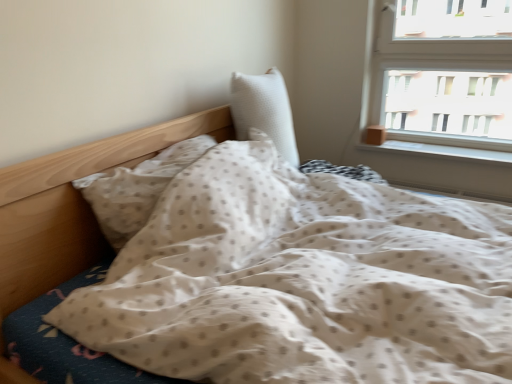
Question: Is white smooth window sill at right inside white textured pillow at center, the first pillow viewed from the right?

Choices:
 (A) no
 (B) yes

Answer: (A)

Question: Considering the relative sizes of white textured pillow at center, the second pillow positioned from the left, and white smooth window sill at right in the image provided, is white textured pillow at center, the second pillow positioned from the left, taller than white smooth window sill at right?

Choices:
 (A) yes
 (B) no

Answer: (A)

Question: Can you confirm if white textured pillow at center, the second pillow positioned from the left, is positioned to the right of white smooth window sill at right?

Choices:
 (A) no
 (B) yes

Answer: (A)

Question: Is white textured pillow at center, the second pillow positioned from the left, closer to camera compared to white smooth window sill at right?

Choices:
 (A) yes
 (B) no

Answer: (A)

Question: Does white textured pillow at center, the second pillow positioned from the left, have a lesser width compared to white smooth window sill at right?

Choices:
 (A) no
 (B) yes

Answer: (A)

Question: Is white textured pillow at center, the first pillow viewed from the right, far from white smooth window sill at right?

Choices:
 (A) no
 (B) yes

Answer: (A)

Question: From the image's perspective, is white textured pillow at center, the first pillow viewed from the right, located above white dotted fabric pillow at center, positioned as the first pillow in left-to-right order?

Choices:
 (A) yes
 (B) no

Answer: (A)

Question: Can you confirm if white textured pillow at center, the first pillow viewed from the right, is taller than white dotted fabric pillow at center, positioned as the first pillow in left-to-right order?

Choices:
 (A) yes
 (B) no

Answer: (A)

Question: Is white textured pillow at center, the first pillow viewed from the right, touching white dotted fabric pillow at center, positioned as the first pillow in left-to-right order?

Choices:
 (A) yes
 (B) no

Answer: (B)

Question: Is white textured pillow at center, the second pillow positioned from the left, closer to the viewer compared to white dotted fabric pillow at center, the second pillow viewed from the right?

Choices:
 (A) yes
 (B) no

Answer: (B)

Question: Does white textured pillow at center, the second pillow positioned from the left, have a larger size compared to white dotted fabric pillow at center, the second pillow viewed from the right?

Choices:
 (A) no
 (B) yes

Answer: (B)

Question: Considering the relative positions of white textured pillow at center, the first pillow viewed from the right, and white dotted fabric pillow at center, positioned as the first pillow in left-to-right order, in the image provided, is white textured pillow at center, the first pillow viewed from the right, behind white dotted fabric pillow at center, positioned as the first pillow in left-to-right order,?

Choices:
 (A) no
 (B) yes

Answer: (B)

Question: Is white smooth window sill at right shorter than white textured pillow at center, the first pillow viewed from the right?

Choices:
 (A) no
 (B) yes

Answer: (B)